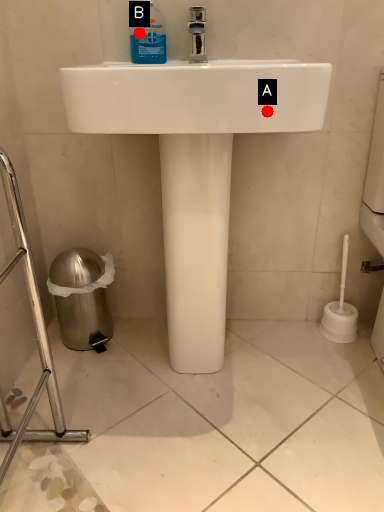
Question: Two points are circled on the image, labeled by A and B beside each circle. Which point is closer to the camera?

Choices:
 (A) A is closer
 (B) B is closer

Answer: (A)